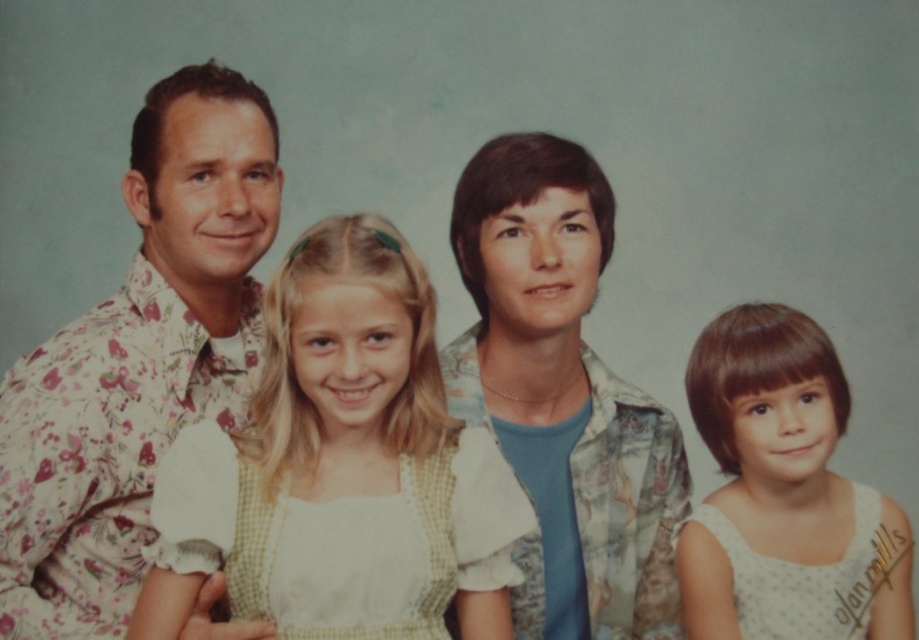
You are standing in front of the family portrait and want to place a small decorative sticker on the image. You have two options for placement based on coordinates provided. The first point is at coordinates point (333, 420) and the second is at point (857, 588). Which coordinate point is closer to the viewer?

Point (333, 420) is in front of point (857, 588), so the sticker placed at point (333, 420) would be closer to the viewer.

In the family portrait, where is the white checkered dress at center located in terms of its 2D coordinates?

The white checkered dress at center is located at the 2D coordinates of point [355,428].